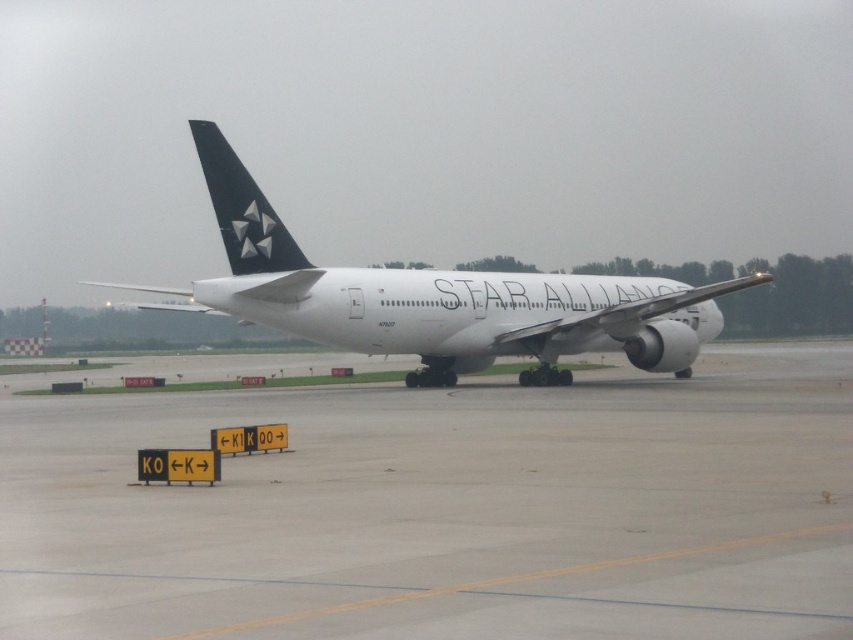
You are standing on the gray concrete tarmac at center. Looking towards the Star Alliance airplane, which direction should you walk to reach the yellow directional signs with black text labeled KO, K1, and KQO?

The gray concrete tarmac at center is located at point [447,509], so you should walk towards the foreground where the yellow directional signs with black text are placed.

You are a pilot approaching the airport and need to determine the position of the gray concrete tarmac at center relative to the white matte airplane at center. Based on the scene, which object is closer to you?

The gray concrete tarmac at center is closer to the viewer than the white matte airplane at center.

You are a pilot preparing to taxi the white matte airplane at center from the current position. There is a narrow path ahead on the gray concrete tarmac at center. Can the airplane fit through the path based on their widths?

The gray concrete tarmac at center is thinner than the white matte airplane at center, so the airplane cannot fit through the path as it is narrower than the airplane.